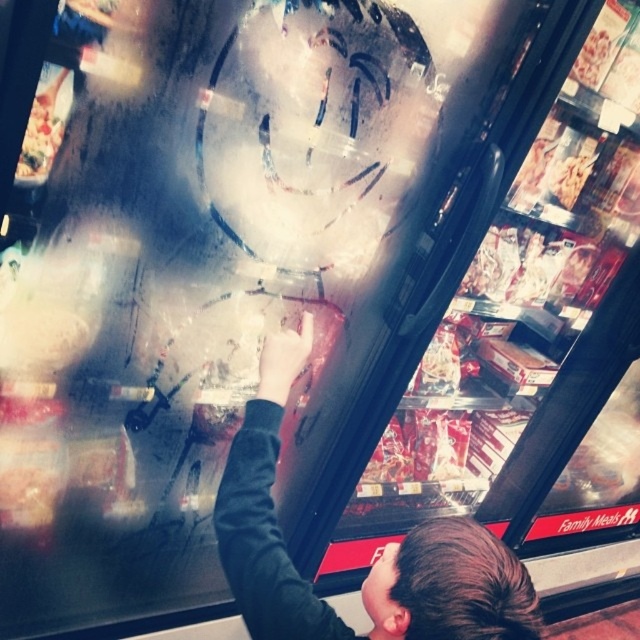
Does black fabric at center have a lesser width compared to white cardboard box at upper left?

No, black fabric at center is not thinner than white cardboard box at upper left.

Is point (259, 372) positioned behind point (51, 147)?

That is True.

Who is more forward, [404,620] or [19,164]?

Point [404,620] is in front.

Where is `black fabric at center`? black fabric at center is located at coordinates (374, 561).